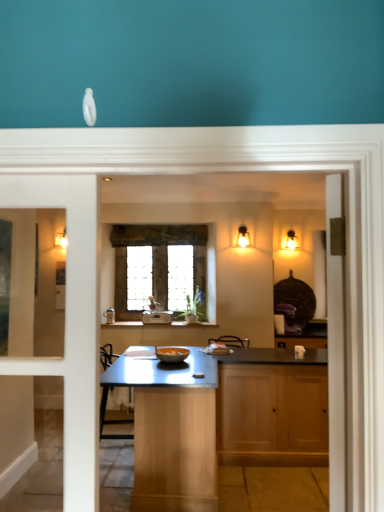
Image resolution: width=384 pixels, height=512 pixels. Describe the element at coordinates (243, 237) in the screenshot. I see `matte glass sconce at upper center, which ranks as the 2th light fixture in back-to-front order` at that location.

What do you see at coordinates (272, 415) in the screenshot? I see `wooden cabinet at center` at bounding box center [272, 415].

Find the location of a particular element. matte glass sconce at upper center, the second light fixture viewed from the right is located at coordinates (243, 237).

Does wooden cabinet at center have a larger size compared to teal matte wall at upper center?

No.

From a real-world perspective, relative to teal matte wall at upper center, is wooden cabinet at center vertically above or below?

In terms of real-world spatial position, wooden cabinet at center is below teal matte wall at upper center.

Is wooden cabinet at center directly adjacent to teal matte wall at upper center?

No, wooden cabinet at center is not next to teal matte wall at upper center.

Is wooden cabinet at center taller than teal matte wall at upper center?

Yes.

Which of these two, teal matte wall at upper center or stained glass window at center, is thinner?

With smaller width is stained glass window at center.

Is teal matte wall at upper center to the left or to the right of stained glass window at center in the image?

teal matte wall at upper center is positioned on stained glass window at center's right side.

Is teal matte wall at upper center facing towards stained glass window at center?

No, teal matte wall at upper center is not aimed at stained glass window at center.

Is teal matte wall at upper center situated inside stained glass window at center or outside?

teal matte wall at upper center is not enclosed by stained glass window at center.

Does point (325, 17) come behind point (221, 432)?

No, (325, 17) is in front of (221, 432).

From the image's perspective, which one is positioned lower, teal matte wall at upper center or wooden cabinet at center?

wooden cabinet at center is shown below in the image.

Is teal matte wall at upper center far away from wooden cabinet at center?

teal matte wall at upper center is far away from wooden cabinet at center.

Considering the positions of objects matte glass sconce at upper center, which is counted as the 1th light fixture, starting from the left, and stained glass window at center in the image provided, who is behind, matte glass sconce at upper center, which is counted as the 1th light fixture, starting from the left, or stained glass window at center?

Positioned behind is stained glass window at center.

Is matte glass sconce at upper center, the second light fixture viewed from the right, taller than stained glass window at center?

In fact, matte glass sconce at upper center, the second light fixture viewed from the right, may be shorter than stained glass window at center.

Is matte glass sconce at upper center, the second light fixture viewed from the right, smaller than stained glass window at center?

Yes, matte glass sconce at upper center, the second light fixture viewed from the right, is smaller than stained glass window at center.

Considering the relative sizes of matte glass sconce at upper center, the second light fixture viewed from the right, and stained glass window at center in the image provided, is matte glass sconce at upper center, the second light fixture viewed from the right, wider than stained glass window at center?

Yes.

Based on their sizes in the image, would you say matte glass sconce at upper center, which is the 1th light fixture in front-to-back order, is bigger or smaller than teal matte wall at upper center?

In the image, matte glass sconce at upper center, which is the 1th light fixture in front-to-back order, appears to be smaller than teal matte wall at upper center.

Considering the relative sizes of matte glass sconce at upper center, which is counted as the 1th light fixture, starting from the left, and teal matte wall at upper center in the image provided, is matte glass sconce at upper center, which is counted as the 1th light fixture, starting from the left, taller than teal matte wall at upper center?

Correct, matte glass sconce at upper center, which is counted as the 1th light fixture, starting from the left, is much taller as teal matte wall at upper center.

From the image's perspective, which is above, matte glass sconce at upper center, which is counted as the 1th light fixture, starting from the left, or teal matte wall at upper center?

teal matte wall at upper center appears higher in the image.

Is point (213, 286) closer to viewer compared to point (316, 48)?

That is False.

Is teal matte wall at upper center inside stained glass window at center?

No, teal matte wall at upper center is not inside stained glass window at center.

In terms of height, does stained glass window at center look taller or shorter compared to teal matte wall at upper center?

Considering their sizes, stained glass window at center has more height than teal matte wall at upper center.

From the image's perspective, is stained glass window at center located beneath teal matte wall at upper center?

Yes, from the image's perspective, stained glass window at center is below teal matte wall at upper center.

Considering the relative sizes of matte gold sconce at upper right, positioned as the 1th light fixture in right-to-left order, and teal matte wall at upper center in the image provided, is matte gold sconce at upper right, positioned as the 1th light fixture in right-to-left order, taller than teal matte wall at upper center?

Correct, matte gold sconce at upper right, positioned as the 1th light fixture in right-to-left order, is much taller as teal matte wall at upper center.

Could you tell me if matte gold sconce at upper right, positioned as the 1th light fixture in right-to-left order, is turned towards teal matte wall at upper center?

No, matte gold sconce at upper right, positioned as the 1th light fixture in right-to-left order, is not aimed at teal matte wall at upper center.

Can teal matte wall at upper center be found inside matte gold sconce at upper right, placed as the 2th light fixture when sorted from left to right?

Actually, teal matte wall at upper center is outside matte gold sconce at upper right, placed as the 2th light fixture when sorted from left to right.

Identify the location of backdrop located above the wooden cabinet at center (from a real-world perspective). (192, 62).

Image resolution: width=384 pixels, height=512 pixels. I want to click on window that is under the teal matte wall at upper center (from a real-world perspective), so click(x=211, y=273).

When comparing their distances from stained glass window at center, does matte gold sconce at upper right, placed as the second light fixture when sorted from front to back, or wooden cabinet at center seem further?

wooden cabinet at center lies further to stained glass window at center than the other object.

Considering their positions, is matte glass sconce at upper center, which ranks as the 2th light fixture in back-to-front order, positioned closer to stained glass window at center than matte gold sconce at upper right, placed as the second light fixture when sorted from front to back?

Based on the image, matte glass sconce at upper center, which ranks as the 2th light fixture in back-to-front order, appears to be nearer to stained glass window at center.

When comparing their distances from wooden cabinet at center, does teal matte wall at upper center or matte gold sconce at upper right, placed as the second light fixture when sorted from front to back, seem further?

teal matte wall at upper center is further to wooden cabinet at center.

Estimate the real-world distances between objects in this image. Which object is closer to teal matte wall at upper center, matte glass sconce at upper center, the second light fixture viewed from the right, or wooden cabinet at center?

Among the two, wooden cabinet at center is located nearer to teal matte wall at upper center.

In the scene shown: Considering their positions, is matte gold sconce at upper right, placed as the second light fixture when sorted from front to back, positioned further to wooden cabinet at center than teal matte wall at upper center?

teal matte wall at upper center is positioned further to the anchor wooden cabinet at center.

When comparing their distances from stained glass window at center, does matte gold sconce at upper right, positioned as the 1th light fixture in right-to-left order, or matte glass sconce at upper center, which is the 1th light fixture in front-to-back order, seem further?

Based on the image, matte gold sconce at upper right, positioned as the 1th light fixture in right-to-left order, appears to be further to stained glass window at center.

Looking at this image, considering their positions, is teal matte wall at upper center positioned further to stained glass window at center than wooden cabinet at center?

teal matte wall at upper center.

Looking at the image, which one is located further to stained glass window at center, teal matte wall at upper center or matte glass sconce at upper center, the second light fixture viewed from the right?

Among the two, teal matte wall at upper center is located further to stained glass window at center.

Find the location of a particular element. The image size is (384, 512). cabinetry between teal matte wall at upper center and matte glass sconce at upper center, the second light fixture viewed from the right, from front to back is located at coordinates (272, 415).

In order to click on light fixture between teal matte wall at upper center and matte gold sconce at upper right, which is the first light fixture from back to front, along the z-axis in this screenshot , I will do `click(243, 237)`.

This screenshot has width=384, height=512. I want to click on light fixture located between stained glass window at center and matte gold sconce at upper right, positioned as the 1th light fixture in right-to-left order, in the left-right direction, so click(243, 237).

You are a GUI agent. You are given a task and a screenshot of the screen. Output one action in this format:
    pyautogui.click(x=<x>, y=<y>)
    Task: Click on the window positioned between wooden cabinet at center and matte gold sconce at upper right, positioned as the 1th light fixture in right-to-left order, from near to far
    Image resolution: width=384 pixels, height=512 pixels.
    Given the screenshot: What is the action you would take?
    pyautogui.click(x=211, y=273)